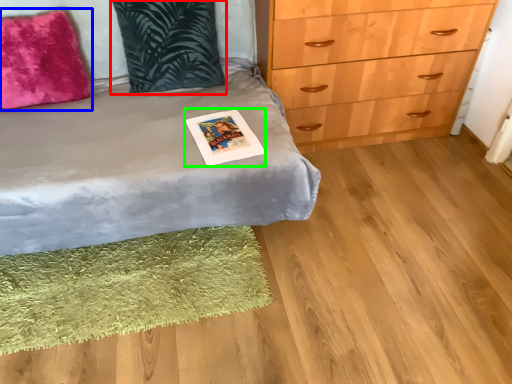
Question: Which object is the closest to the pillow (highlighted by a red box)? Choose among these: pillow (highlighted by a blue box) or postcard (highlighted by a green box).

Choices:
 (A) pillow
 (B) postcard

Answer: (A)